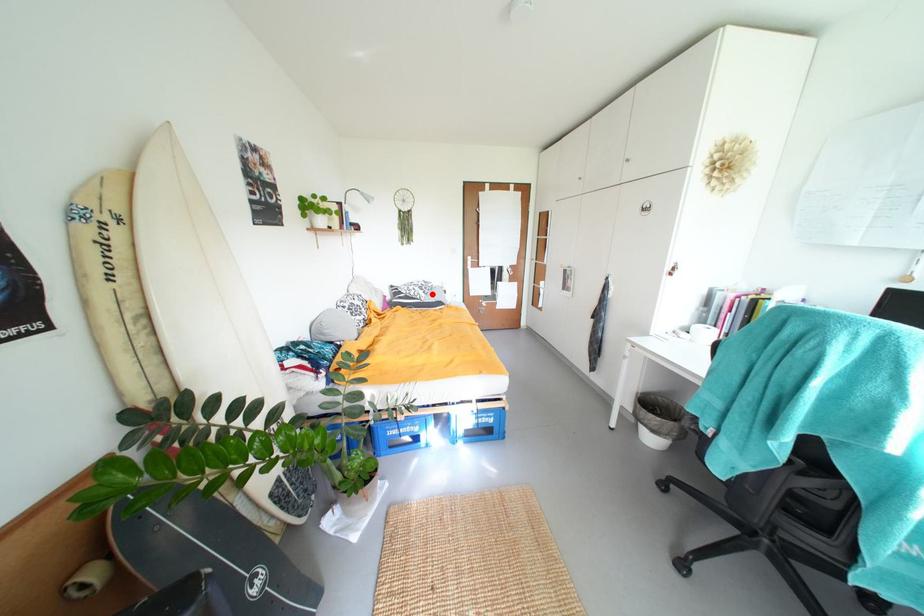
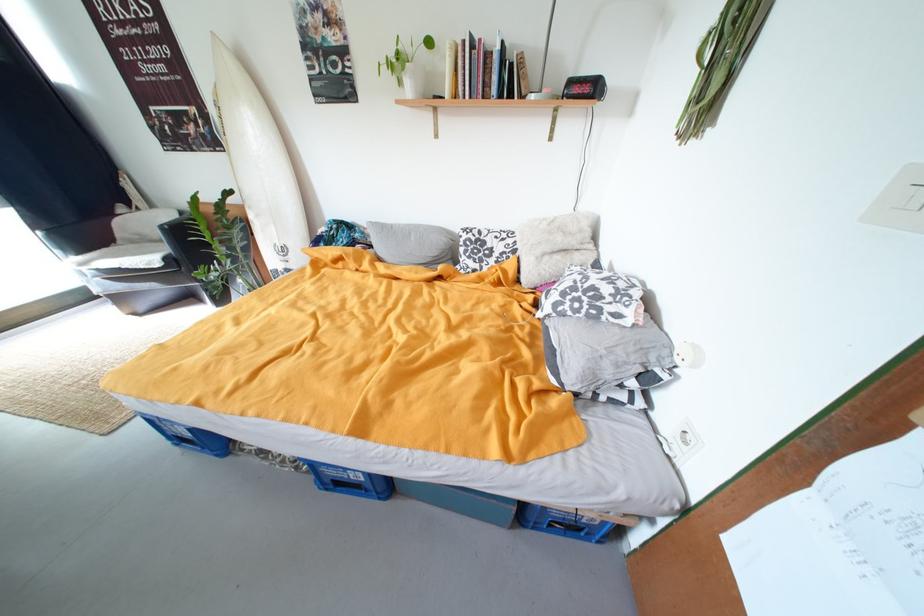
Locate, in the second image, the point that corresponds to the highlighted location in the first image.

(564, 306)